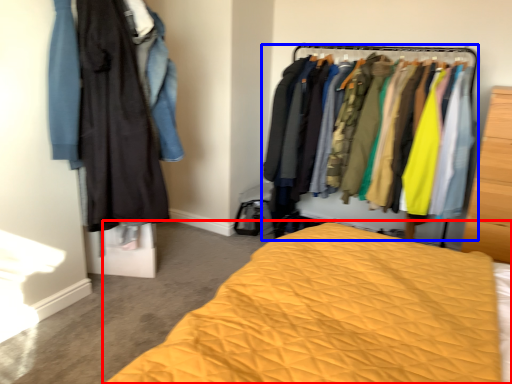
Question: Among these objects, which one is farthest to the camera, bed (highlighted by a red box) or closet (highlighted by a blue box)?

Choices:
 (A) bed
 (B) closet

Answer: (B)